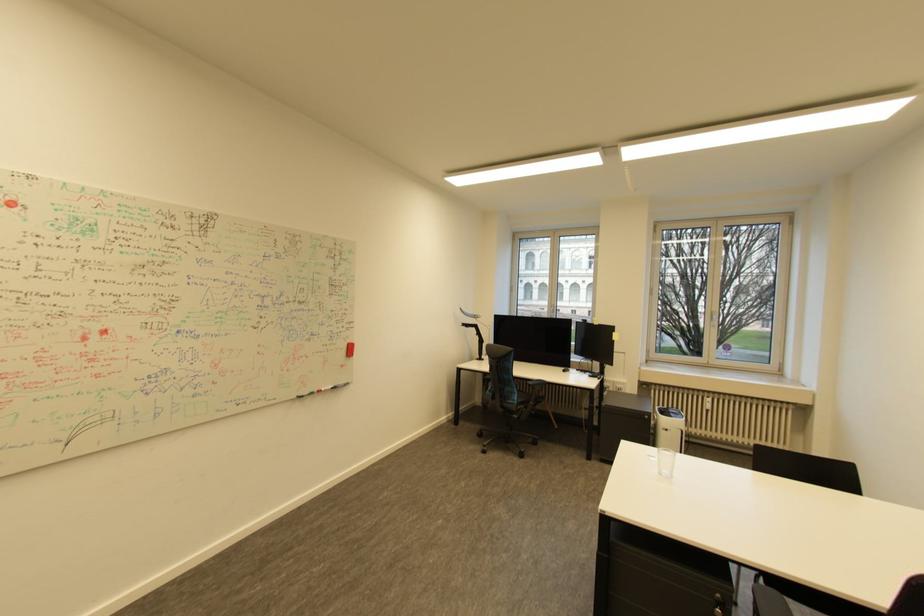
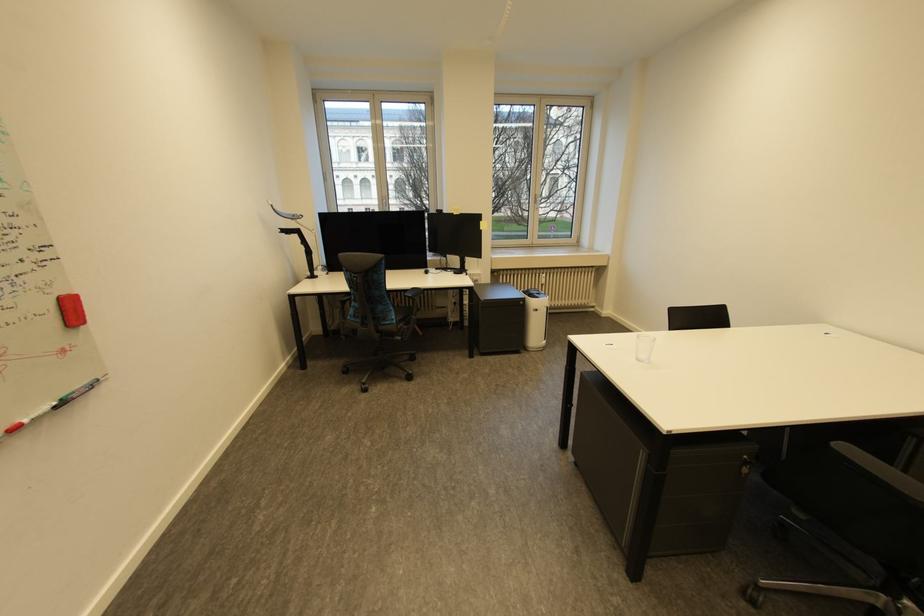
In the second image, find the point that corresponds to (322,392) in the first image.

(6, 436)